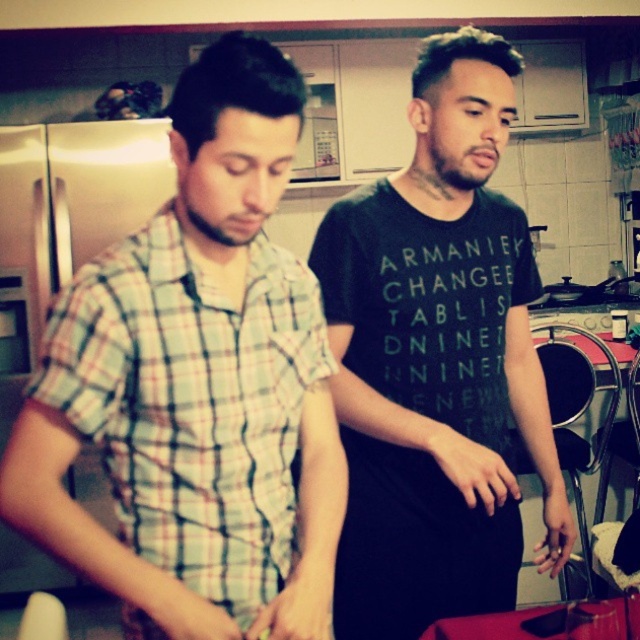
What do you see at coordinates (196, 387) in the screenshot? I see `plaid cotton shirt at center` at bounding box center [196, 387].

Which is in front, point (268, 588) or point (424, 504)?

Point (268, 588) is in front.

Does point (140, 516) come in front of point (492, 540)?

Yes, point (140, 516) is closer to viewer.

Locate an element on the screen. This screenshot has height=640, width=640. plaid cotton shirt at center is located at coordinates (196, 387).